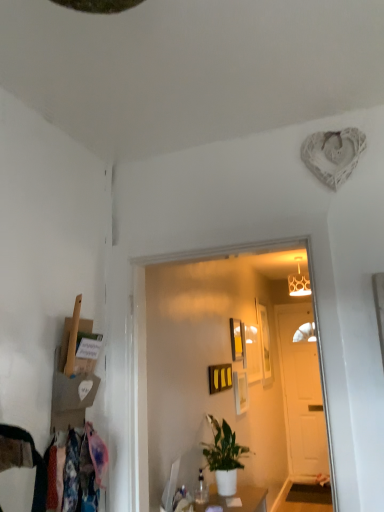
Question: Would you say wooden picture frame at center, which is the 5th picture frame from front to back, contains matte gold lampshade at upper center?

Choices:
 (A) no
 (B) yes

Answer: (A)

Question: Is wooden picture frame at center, which is the 5th picture frame from front to back, behind matte gold lampshade at upper center?

Choices:
 (A) no
 (B) yes

Answer: (B)

Question: From a real-world perspective, does wooden picture frame at center, arranged as the 1th picture frame when viewed from the back, stand above matte gold lampshade at upper center?

Choices:
 (A) yes
 (B) no

Answer: (B)

Question: Would you consider wooden picture frame at center, which is the 5th picture frame from front to back, to be distant from matte gold lampshade at upper center?

Choices:
 (A) no
 (B) yes

Answer: (A)

Question: Is the surface of wooden picture frame at center, which is the 5th picture frame from front to back, in direct contact with matte gold lampshade at upper center?

Choices:
 (A) yes
 (B) no

Answer: (B)

Question: From the image's perspective, is matte gold lampshade at upper center positioned above or below matte black picture frame at center, marked as the fourth picture frame in a back-to-front arrangement?

Choices:
 (A) above
 (B) below

Answer: (A)

Question: Is matte gold lampshade at upper center spatially inside matte black picture frame at center, marked as the fourth picture frame in a back-to-front arrangement, or outside of it?

Choices:
 (A) inside
 (B) outside

Answer: (B)

Question: In terms of width, does matte gold lampshade at upper center look wider or thinner when compared to matte black picture frame at center, acting as the second picture frame starting from the front?

Choices:
 (A) thin
 (B) wide

Answer: (B)

Question: From a real-world perspective, relative to matte black picture frame at center, acting as the second picture frame starting from the front, is matte gold lampshade at upper center vertically above or below?

Choices:
 (A) below
 (B) above

Answer: (B)

Question: Considering their positions, is matte gold lampshade at upper center located in front of or behind white wooden door at center?

Choices:
 (A) front
 (B) behind

Answer: (A)

Question: From a real-world perspective, is matte gold lampshade at upper center above or below white wooden door at center?

Choices:
 (A) below
 (B) above

Answer: (B)

Question: From the image's perspective, is matte gold lampshade at upper center located above or below white wooden door at center?

Choices:
 (A) above
 (B) below

Answer: (A)

Question: Looking at their shapes, would you say matte gold lampshade at upper center is wider or thinner than white wooden door at center?

Choices:
 (A) wide
 (B) thin

Answer: (A)

Question: Based on their positions, is white wooden door at center located to the left or right of matte black picture frame at center, which ranks as the 3th picture frame in back-to-front order?

Choices:
 (A) left
 (B) right

Answer: (B)

Question: Considering their positions, is white wooden door at center located in front of or behind matte black picture frame at center, which ranks as the 3th picture frame in back-to-front order?

Choices:
 (A) behind
 (B) front

Answer: (A)